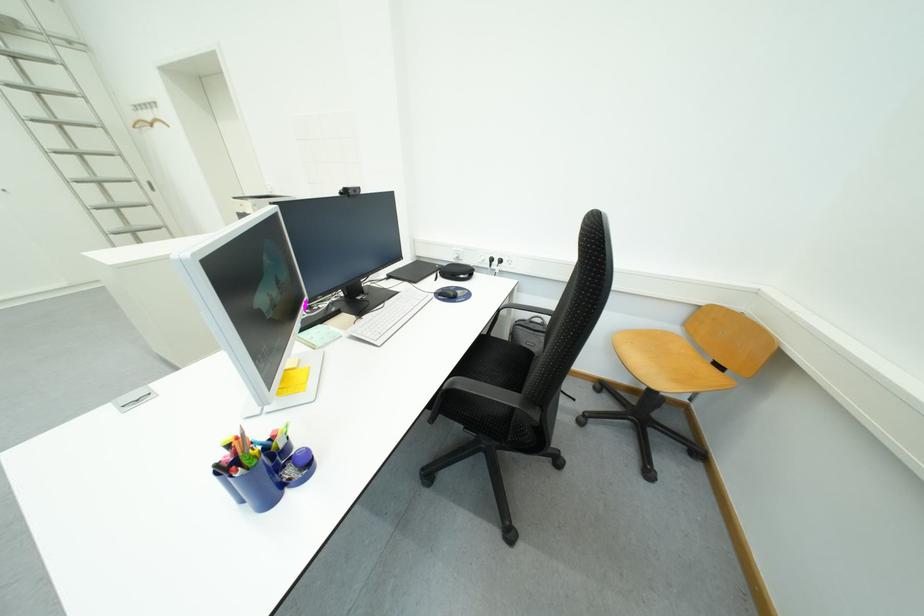
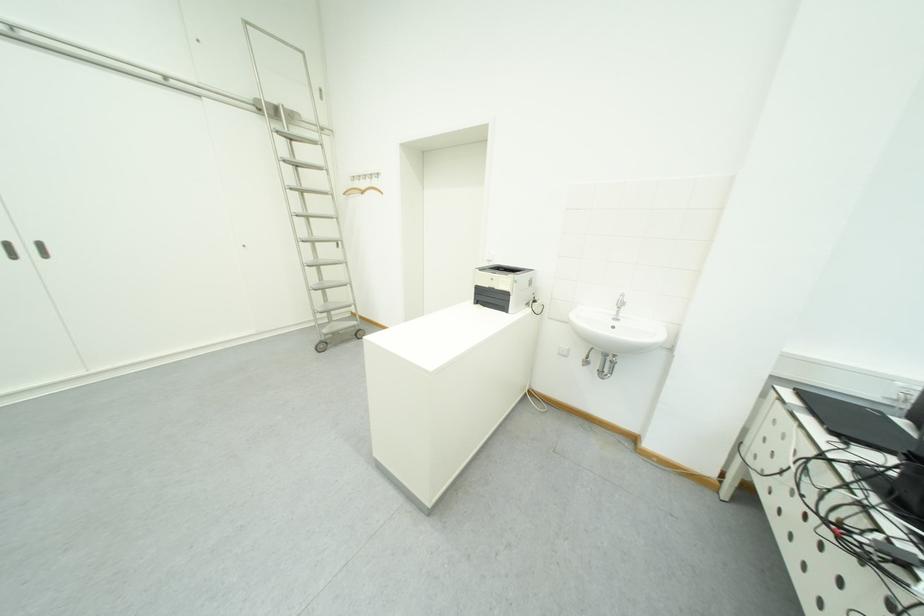
The point at (95,148) is marked in the first image. Where is the corresponding point in the second image?

(322, 213)